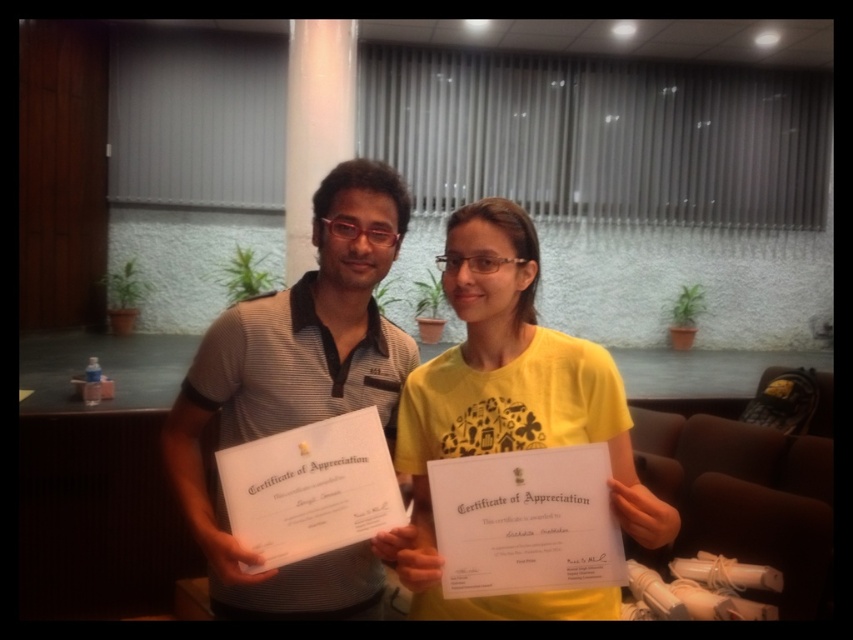
Question: In this image, where is matte gray shirt at center located relative to yellow matte shirt at center?

Choices:
 (A) below
 (B) above

Answer: (B)

Question: Is matte gray shirt at center bigger than yellow matte shirt at center?

Choices:
 (A) no
 (B) yes

Answer: (B)

Question: Among these objects, which one is farthest from the camera?

Choices:
 (A) yellow matte shirt at center
 (B) matte gray shirt at center

Answer: (B)

Question: Among these points, which one is farthest from the camera?

Choices:
 (A) (492, 424)
 (B) (311, 609)

Answer: (B)

Question: Which object appears closest to the camera in this image?

Choices:
 (A) matte gray shirt at center
 (B) yellow matte shirt at center

Answer: (B)

Question: Does matte gray shirt at center have a larger size compared to yellow matte shirt at center?

Choices:
 (A) no
 (B) yes

Answer: (B)